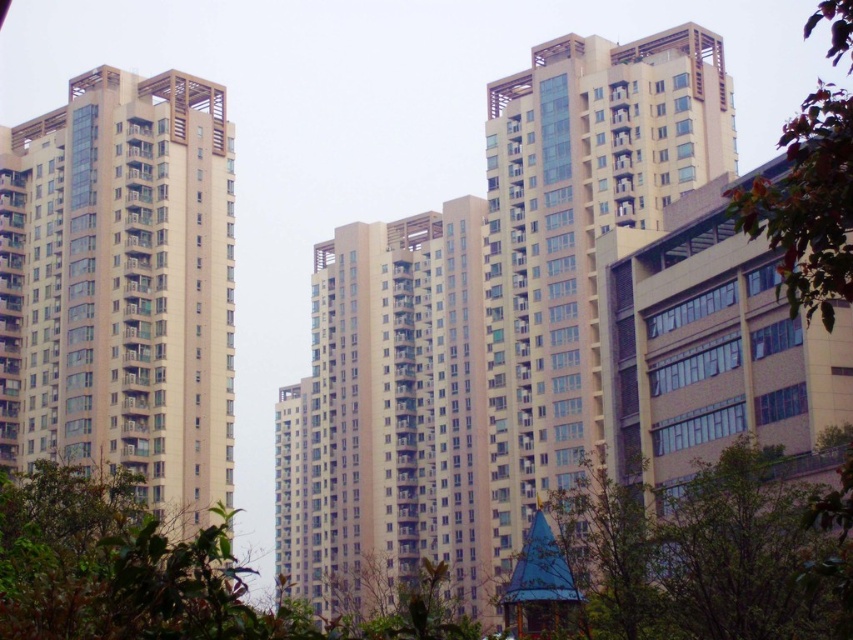
Who is more forward, (637, 154) or (840, 180)?

Point (840, 180) is more forward.

Which of these two, beige glass building at center or green leafy tree at right, stands taller?

With more height is green leafy tree at right.

Who is more distant from viewer, [563,371] or [840,196]?

Positioned behind is point [563,371].

Image resolution: width=853 pixels, height=640 pixels. In order to click on beige glass building at center in this screenshot , I will do `click(579, 236)`.

From the picture: Measure the distance from beige smooth building at left to green leafy tree at lower center.

A distance of 188.48 feet exists between beige smooth building at left and green leafy tree at lower center.

Does beige smooth building at left have a greater width compared to green leafy tree at lower center?

Indeed, beige smooth building at left has a greater width compared to green leafy tree at lower center.

Is point (166, 257) behind point (579, 492)?

Yes, point (166, 257) is farther from viewer.

Find the location of a particular element. This screenshot has height=640, width=853. beige smooth building at left is located at coordinates (122, 288).

Does beige glass building at center have a larger size compared to green leafy tree at lower center?

Correct, beige glass building at center is larger in size than green leafy tree at lower center.

How much distance is there between beige glass building at center and green leafy tree at lower center?

31.51 meters

Is point (492, 147) positioned after point (561, 541)?

Yes, point (492, 147) is behind point (561, 541).

At what (x,y) coordinates should I click in order to perform the action: click on beige glass building at center. Please return your answer as a coordinate pair (x, y). Looking at the image, I should click on (579, 236).